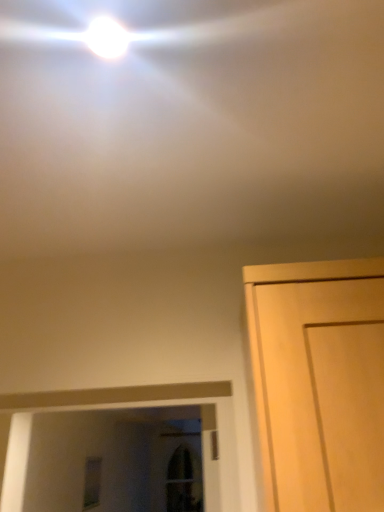
Question: Does white glossy droplight at upper center have a lesser height compared to light wood door at right?

Choices:
 (A) yes
 (B) no

Answer: (A)

Question: Is white glossy droplight at upper center positioned behind light wood door at right?

Choices:
 (A) yes
 (B) no

Answer: (A)

Question: Can you confirm if white glossy droplight at upper center is wider than light wood door at right?

Choices:
 (A) yes
 (B) no

Answer: (B)

Question: From a real-world perspective, is white glossy droplight at upper center physically above light wood door at right?

Choices:
 (A) yes
 (B) no

Answer: (A)

Question: From a real-world perspective, is white glossy droplight at upper center beneath light wood door at right?

Choices:
 (A) yes
 (B) no

Answer: (B)

Question: In the image, is light wood door at right positioned in front of or behind clear glass window at lower left?

Choices:
 (A) behind
 (B) front

Answer: (B)

Question: Based on their sizes in the image, would you say light wood door at right is bigger or smaller than clear glass window at lower left?

Choices:
 (A) big
 (B) small

Answer: (A)

Question: From a real-world perspective, relative to clear glass window at lower left, is light wood door at right vertically above or below?

Choices:
 (A) above
 (B) below

Answer: (A)

Question: From their relative heights in the image, would you say light wood door at right is taller or shorter than clear glass window at lower left?

Choices:
 (A) short
 (B) tall

Answer: (A)

Question: In the image, is clear glass window at lower left positioned in front of or behind light wood door at right?

Choices:
 (A) behind
 (B) front

Answer: (A)

Question: Considering the positions of clear glass window at lower left and light wood door at right in the image, is clear glass window at lower left bigger or smaller than light wood door at right?

Choices:
 (A) big
 (B) small

Answer: (B)

Question: From a real-world perspective, is clear glass window at lower left physically located above or below light wood door at right?

Choices:
 (A) below
 (B) above

Answer: (A)

Question: Considering the positions of clear glass window at lower left and light wood door at right in the image, is clear glass window at lower left taller or shorter than light wood door at right?

Choices:
 (A) tall
 (B) short

Answer: (A)

Question: Considering the positions of white glossy droplight at upper center and light wood door at right in the image, is white glossy droplight at upper center taller or shorter than light wood door at right?

Choices:
 (A) short
 (B) tall

Answer: (A)

Question: Relative to light wood door at right, is white glossy droplight at upper center in front or behind?

Choices:
 (A) front
 (B) behind

Answer: (B)